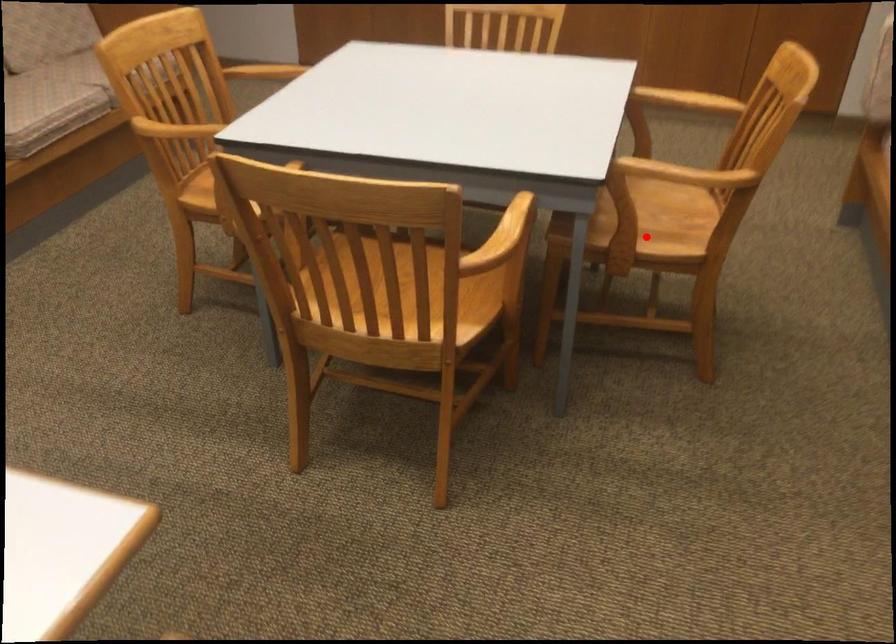
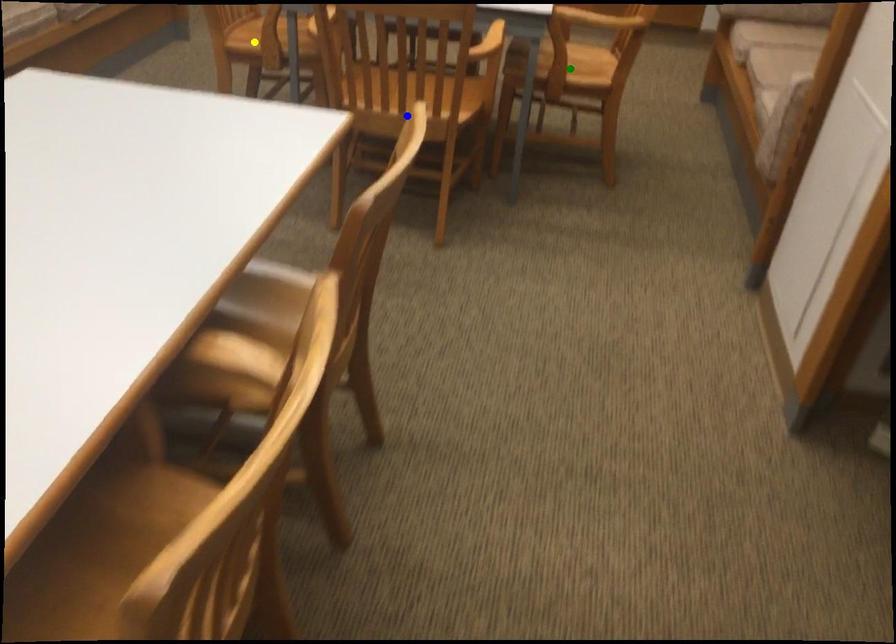
Question: I am providing you with two images of the same scene from different viewpoints. A red point is marked on the first image. You are given multiple points on the second image. Which point in image 2 is actually the same real-world point as the red point in image 1?

Choices:
 (A) blue point
 (B) green point
 (C) yellow point

Answer: (B)